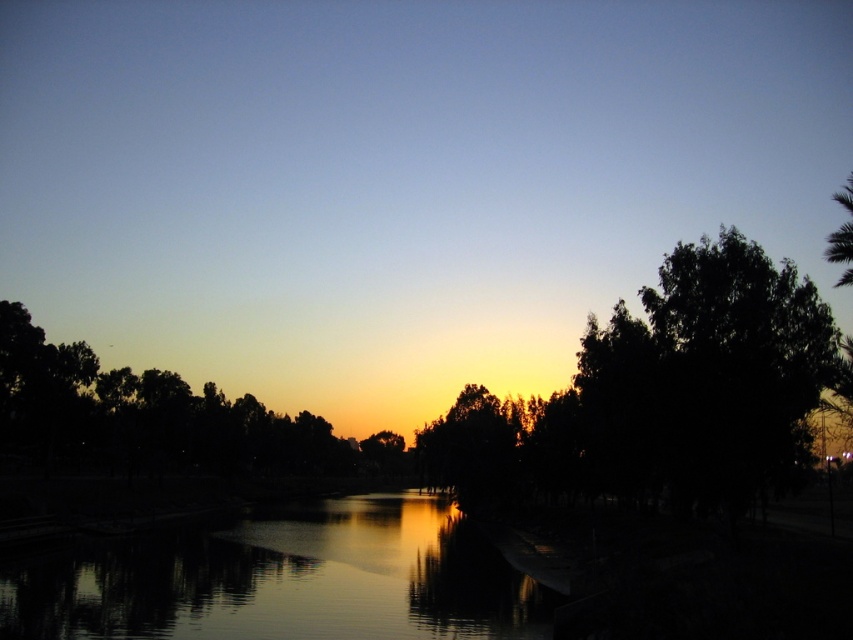
Is silky smooth water at center to the right of dark green leafy tree at right from the viewer's perspective?

In fact, silky smooth water at center is to the left of dark green leafy tree at right.

The width and height of the screenshot is (853, 640). I want to click on silky smooth water at center, so click(283, 580).

Is silky smooth water at center to the left of green leafy tree at upper right from the viewer's perspective?

Indeed, silky smooth water at center is positioned on the left side of green leafy tree at upper right.

Between silky smooth water at center and green leafy tree at upper right, which one appears on the left side from the viewer's perspective?

Positioned to the left is silky smooth water at center.

Image resolution: width=853 pixels, height=640 pixels. What do you see at coordinates (283, 580) in the screenshot?
I see `silky smooth water at center` at bounding box center [283, 580].

Where is `silky smooth water at center`? silky smooth water at center is located at coordinates (283, 580).

Can you confirm if dark green leafy tree at right is positioned to the left of green leafy tree at upper right?

Yes, dark green leafy tree at right is to the left of green leafy tree at upper right.

Which of these two, dark green leafy tree at right or green leafy tree at upper right, stands shorter?

Standing shorter between the two is dark green leafy tree at right.

Between point (776, 344) and point (838, 250), which one is positioned behind?

Positioned behind is point (776, 344).

Where is `dark green leafy tree at right`? The height and width of the screenshot is (640, 853). dark green leafy tree at right is located at coordinates (706, 376).